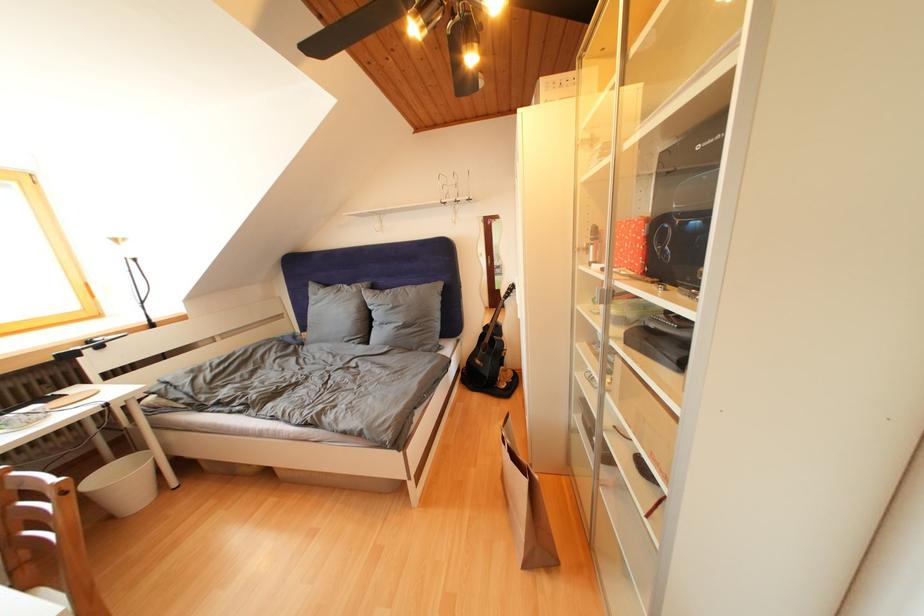
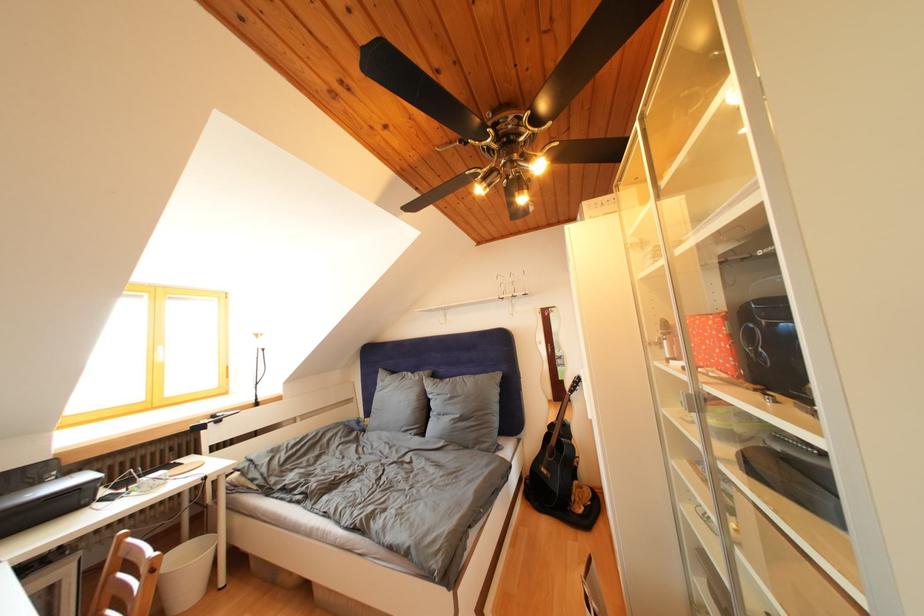
Where in the second image is the point corresponding to point (334, 291) from the first image?

(400, 378)